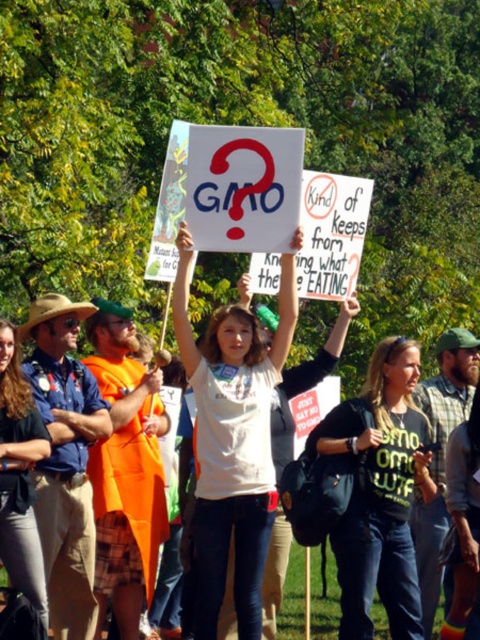
Question: Which point appears farthest from the camera in this image?

Choices:
 (A) (7, 486)
 (B) (233, 404)
 (C) (324, 448)

Answer: (B)

Question: Which point is closer to the camera?

Choices:
 (A) (0, 486)
 (B) (216, 394)
 (C) (399, 614)

Answer: (A)

Question: Is green matte shirt at center closer to the viewer compared to denim pants at lower left?

Choices:
 (A) no
 (B) yes

Answer: (A)

Question: Which of the following is the farthest from the observer?

Choices:
 (A) (11, 365)
 (B) (194, 627)

Answer: (B)

Question: Does green matte shirt at center appear on the left side of denim pants at lower left?

Choices:
 (A) no
 (B) yes

Answer: (A)

Question: From the image, what is the correct spatial relationship of white cotton shirt at center in relation to denim pants at lower left?

Choices:
 (A) below
 (B) above

Answer: (B)